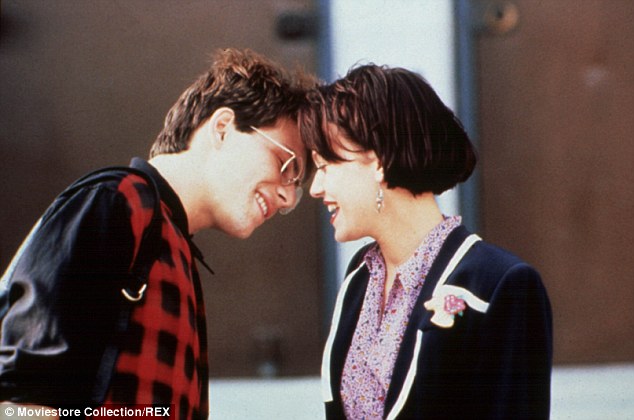
Find the location of a particular element. door is located at coordinates (259, 25), (548, 89).